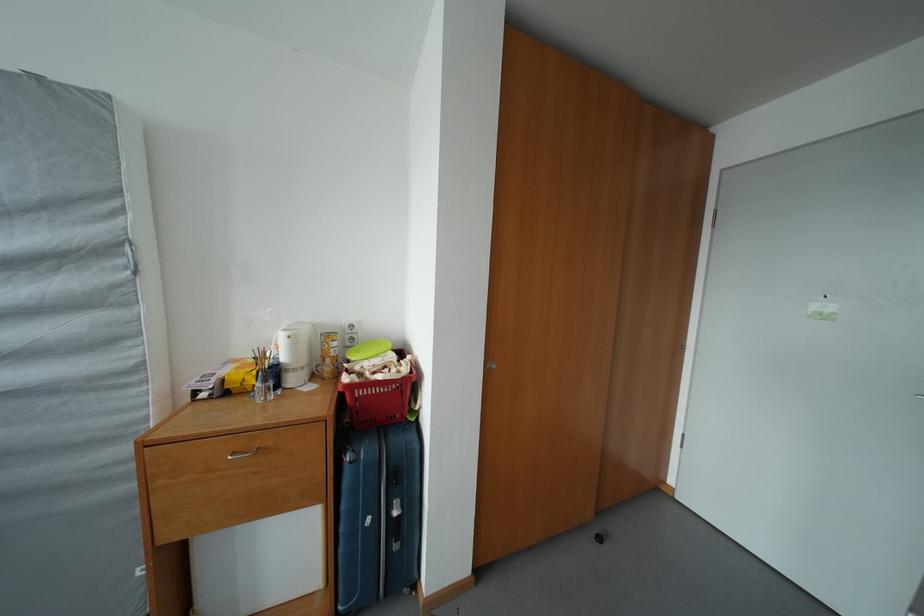
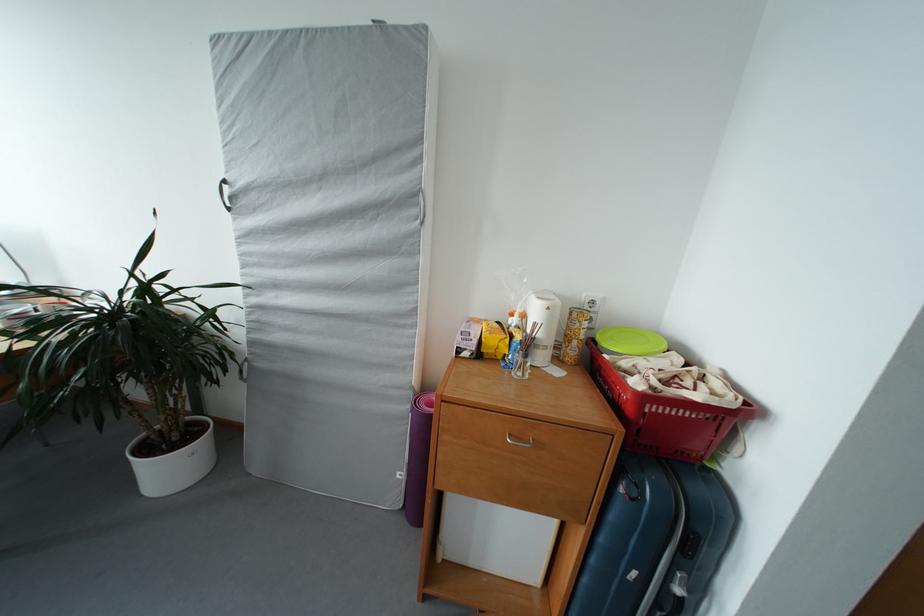
Question: The camera is either moving clockwise (left) or counter-clockwise (right) around the object. The first image is from the beginning of the video and the second image is from the end. Is the camera moving left or right when shooting the video?

Choices:
 (A) Left
 (B) Right

Answer: (B)